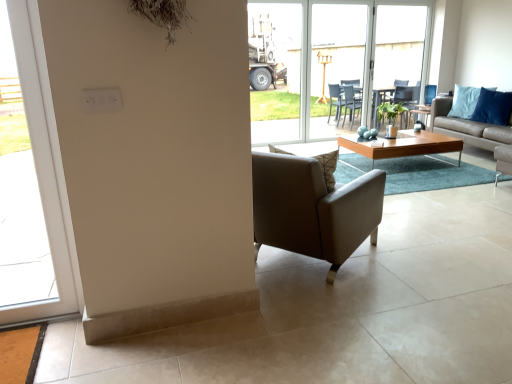
Measure the distance between leather at center and camera.

leather at center and camera are 2.20 meters apart.

At what (x,y) coordinates should I click in order to perform the action: click on green matte plant at center. Please return your answer as a coordinate pair (x, y). Looking at the image, I should click on (390, 116).

I want to click on transparent plastic screen door at center, arranged as the first screen door when viewed from the left, so click(334, 60).

How much space does transparent plastic screen door at center, which is the second screen door in right-to-left order, occupy horizontally?

4.17 inches.

The width and height of the screenshot is (512, 384). What are the coordinates of `leather at center` in the screenshot? It's located at (313, 209).

Does transparent glass door at center, the second window positioned from the front, appear on the left side of transparent glass screen door at center, the 2th screen door from the left?

Yes.

Does transparent glass door at center, the second window positioned from the front, have a greater height compared to transparent glass screen door at center, the 2th screen door from the left?

Incorrect, the height of transparent glass door at center, the second window positioned from the front, is not larger of that of transparent glass screen door at center, the 2th screen door from the left.

From a real-world perspective, which object rests below the other?

From a 3D spatial view, transparent glass door at center, the 1th window positioned from the back, is below.

From the image's perspective, is transparent glass door at center, positioned as the 2th window in left-to-right order, beneath transparent glass screen door at center, marked as the first screen door in a right-to-left arrangement?

Yes.

Considering the relative sizes of white glass window at left, the 1th window in the bottom-to-top sequence, and green matte plant at center in the image provided, is white glass window at left, the 1th window in the bottom-to-top sequence, smaller than green matte plant at center?

Actually, white glass window at left, the 1th window in the bottom-to-top sequence, might be larger than green matte plant at center.

From the image's perspective, which is above, white glass window at left, the first window in the left-to-right sequence, or green matte plant at center?

green matte plant at center.

Is white glass window at left, marked as the first window in a front-to-back arrangement, next to green matte plant at center and touching it?

white glass window at left, marked as the first window in a front-to-back arrangement, and green matte plant at center are clearly separated.

How much distance is there between white glass window at left, which appears as the second window when viewed from the top, and green matte plant at center?

12.96 feet.

From the image's perspective, is green matte plant at center under transparent plastic screen door at center, arranged as the first screen door when viewed from the left?

Yes.

Is green matte plant at center bigger than transparent plastic screen door at center, arranged as the first screen door when viewed from the left?

No.

Does point (396, 109) lie behind point (325, 74)?

No, it is not.

Based on the photo, measure the distance between green matte plant at center and transparent glass screen door at center, the 2th screen door from the left.

green matte plant at center and transparent glass screen door at center, the 2th screen door from the left, are 3.62 feet apart from each other.

Does green matte plant at center contain transparent glass screen door at center, the 2th screen door from the left?

No, transparent glass screen door at center, the 2th screen door from the left, is not inside green matte plant at center.

Between green matte plant at center and transparent glass screen door at center, marked as the first screen door in a right-to-left arrangement, which one has larger size?

transparent glass screen door at center, marked as the first screen door in a right-to-left arrangement, is bigger.

Considering the relative sizes of green matte plant at center and transparent glass screen door at center, marked as the first screen door in a right-to-left arrangement, in the image provided, is green matte plant at center wider than transparent glass screen door at center, marked as the first screen door in a right-to-left arrangement,?

Yes.

Can green matte plant at center be found inside transparent plastic screen door at center, arranged as the first screen door when viewed from the left?

No, green matte plant at center is located outside of transparent plastic screen door at center, arranged as the first screen door when viewed from the left.

Looking at this image, from the image's perspective, is transparent plastic screen door at center, arranged as the first screen door when viewed from the left, located beneath green matte plant at center?

Incorrect, from the image's perspective, transparent plastic screen door at center, arranged as the first screen door when viewed from the left, is higher than green matte plant at center.

Is transparent plastic screen door at center, arranged as the first screen door when viewed from the left, taller than green matte plant at center?

Correct, transparent plastic screen door at center, arranged as the first screen door when viewed from the left, is much taller as green matte plant at center.

Considering the positions of objects transparent plastic screen door at center, arranged as the first screen door when viewed from the left, and green matte plant at center in the image provided, who is more to the left, transparent plastic screen door at center, arranged as the first screen door when viewed from the left, or green matte plant at center?

transparent plastic screen door at center, arranged as the first screen door when viewed from the left, is more to the left.

The height and width of the screenshot is (384, 512). Identify the location of the 2nd screen door counting from the right of the leather at center. (400, 44).

Is leather at center bigger than transparent glass screen door at center, the 2th screen door from the left?

Yes.

From the image's perspective, does leather at center appear higher than transparent glass screen door at center, the 2th screen door from the left?

Incorrect, from the image's perspective, leather at center is lower than transparent glass screen door at center, the 2th screen door from the left.

Would you say leather at center is a long distance from transparent glass screen door at center, marked as the first screen door in a right-to-left arrangement?

Yes, leather at center and transparent glass screen door at center, marked as the first screen door in a right-to-left arrangement, are located far from each other.

Does transparent plastic screen door at center, which is the second screen door in right-to-left order, lie in front of blue fabric pillow at upper right?

No, it is behind blue fabric pillow at upper right.

Would you say transparent plastic screen door at center, arranged as the first screen door when viewed from the left, is outside blue fabric pillow at upper right?

Yes.

Measure the distance between transparent plastic screen door at center, which is the second screen door in right-to-left order, and blue fabric pillow at upper right.

They are 2.18 meters apart.

Between transparent plastic screen door at center, which is the second screen door in right-to-left order, and blue fabric pillow at upper right, which one has smaller size?

blue fabric pillow at upper right is smaller.

There is a transparent glass screen door at center, marked as the first screen door in a right-to-left arrangement. Where is `the 1st window below it (from the image's perspective)`? The height and width of the screenshot is (384, 512). the 1st window below it (from the image's perspective) is located at coordinates (334, 62).

Image resolution: width=512 pixels, height=384 pixels. There is a green matte plant at center. Find the location of `the 1st window above it (from a real-world perspective)`. the 1st window above it (from a real-world perspective) is located at coordinates (45, 168).

Considering their positions, is transparent glass door at center, positioned as the 2th window in left-to-right order, positioned further to light brown leather couch at center right than transparent plastic screen door at center, which is the second screen door in right-to-left order?

Based on the image, transparent glass door at center, positioned as the 2th window in left-to-right order, appears to be further to light brown leather couch at center right.

Which object lies further to the anchor point blue fabric pillow at upper right, transparent glass screen door at center, marked as the first screen door in a right-to-left arrangement, or leather at center?

leather at center lies further to blue fabric pillow at upper right than the other object.

Looking at the image, which one is located further to light brown wooden coffee table at center, transparent glass door at center, which ranks as the 1th window in top-to-bottom order, or light brown leather couch at center right?

light brown leather couch at center right is further to light brown wooden coffee table at center.

Estimate the real-world distances between objects in this image. Which object is further from leather at center, transparent glass door at center, the 1th window from the right, or blue fabric pillow at upper right?

Among the two, blue fabric pillow at upper right is located further to leather at center.

Looking at the image, which one is located closer to leather at center, light brown wooden coffee table at center or transparent plastic screen door at center, which is the second screen door in right-to-left order?

Based on the image, light brown wooden coffee table at center appears to be nearer to leather at center.

Looking at the image, which one is located closer to transparent glass screen door at center, the 2th screen door from the left, transparent glass door at center, the second window positioned from the front, or light brown leather couch at center right?

transparent glass door at center, the second window positioned from the front, is positioned closer to the anchor transparent glass screen door at center, the 2th screen door from the left.

Which object lies further to the anchor point light brown leather couch at center right, leather at center or white glass window at left, marked as the first window in a front-to-back arrangement?

white glass window at left, marked as the first window in a front-to-back arrangement, is positioned further to the anchor light brown leather couch at center right.

Considering their positions, is leather at center positioned closer to light brown wooden coffee table at center than green matte plant at center?

The object closer to light brown wooden coffee table at center is green matte plant at center.

You are a GUI agent. You are given a task and a screenshot of the screen. Output one action in this format:
    pyautogui.click(x=<x>, y=<y>)
    Task: Click on the chair between white glass window at left, positioned as the 2th window in right-to-left order, and transparent glass door at center, the 1th window from the right, in the front-back direction
    The width and height of the screenshot is (512, 384).
    Given the screenshot: What is the action you would take?
    pyautogui.click(x=313, y=209)

Find the location of a particular element. This screenshot has width=512, height=384. houseplant situated between transparent glass door at center, the 1th window from the right, and blue fabric pillow at upper right from left to right is located at coordinates (390, 116).

This screenshot has height=384, width=512. Identify the location of window between white glass window at left, the 1th window in the bottom-to-top sequence, and transparent plastic screen door at center, which is the second screen door in right-to-left order, along the z-axis. (334, 62).

Where is `studio couch between leather at center and green matte plant at center from front to back`? The height and width of the screenshot is (384, 512). studio couch between leather at center and green matte plant at center from front to back is located at coordinates click(x=466, y=127).